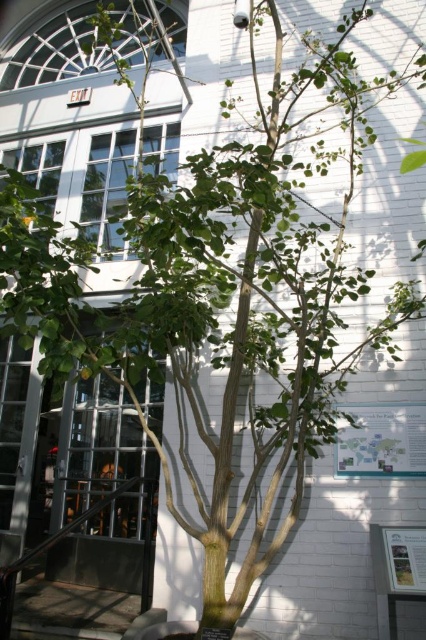
You are standing in front of the metallic glass door at center and want to check the green paper map at center. Which direction should you turn to face the map?

The green paper map at center is to the right of the metallic glass door at center, so you should turn to your right to face the map.

You are standing in a hallway and see the metallic glass door at center. If you walk straight ahead, will you reach the door before walking 3 meters?

The metallic glass door at center is 2.74 meters away from viewer. Yes, you will reach the door before walking 3 meters because the distance is less than 3 meters.

Based on the photo, you are standing in front of the tree supported by a wooden stake near the white brick wall with a signboard. There is an open glass door to your left with an EXIT sign above it. A point marked at coordinates point (345,435) is visible in the scene. If you want to reach this point, should you move towards the tree or away from it?

The point (345,435) is 3.85 meters from the viewer. Since the point is at that distance, you should move towards the tree to reach it because the tree is part of the scene closer than 3.85 meters, but wait the description says the point is 3.85 meters away. Hmm, maybe I need to think again. Wait the question is whether to move towards or away. If the point is 3.85 meters away, and the tree is supported by a stake, maybe the tree is closer than that? Or is the point located further away? The scene says